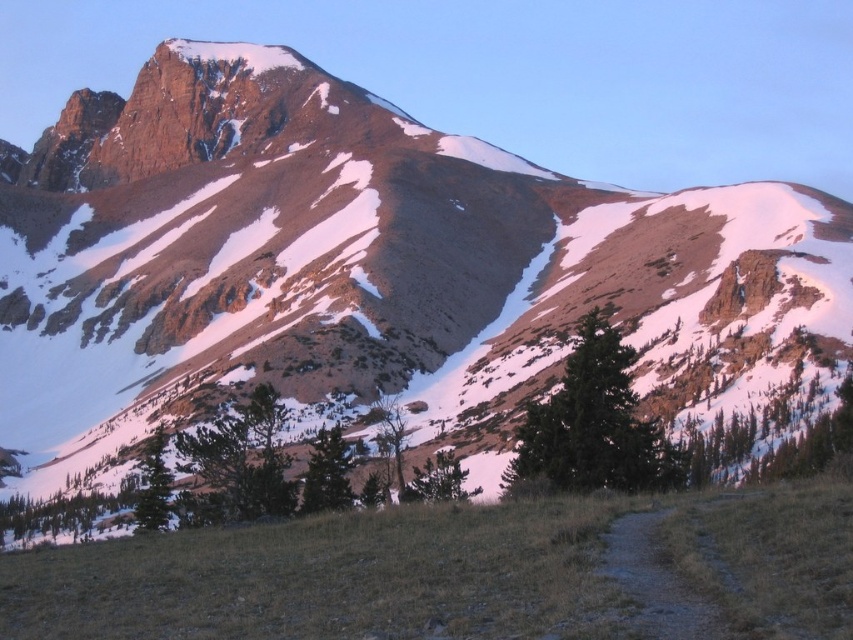
You are an environmental scientist studying the mountain ecosystem. You observe the green textured tree at center and the green matte tree at lower center. Which tree is located higher up the slope compared to the other?

The green textured tree at center is positioned over the green matte tree at lower center, so it is located higher up the slope.

You are a hiker who wants to reach the mountain peak. You are currently standing on the brown dirt path at center and see the green matte tree at lower center. How far apart are these two landmarks?

The brown dirt path at center and green matte tree at lower center are 96.21 feet apart from each other.

You are an environmental scientist studying the mountain ecosystem. You observe the green textured tree at center and the green matte tree at lower center. Which tree is positioned closer to the mountain base?

The green textured tree at center is closer to the viewer than the green matte tree at lower center, so the green textured tree at center is positioned closer to the mountain base.